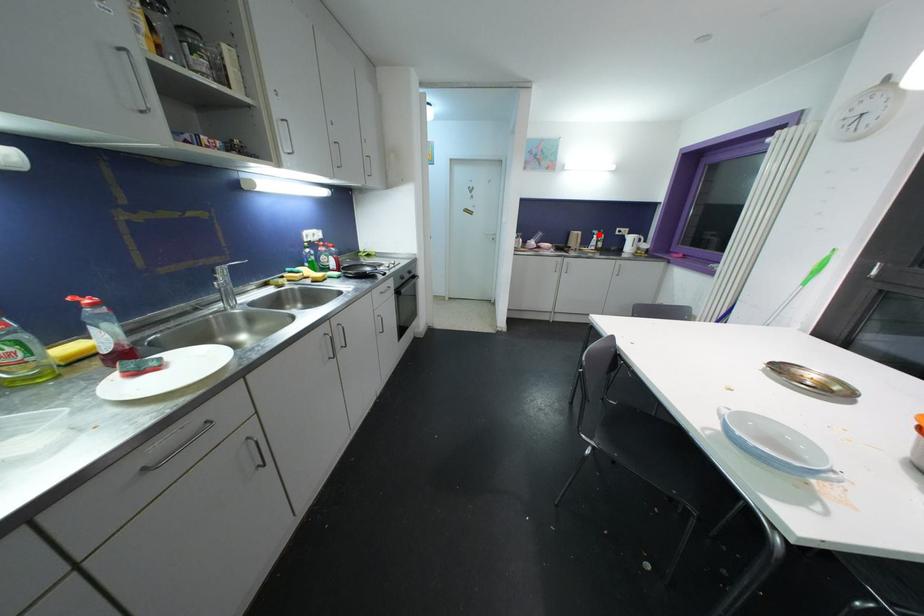
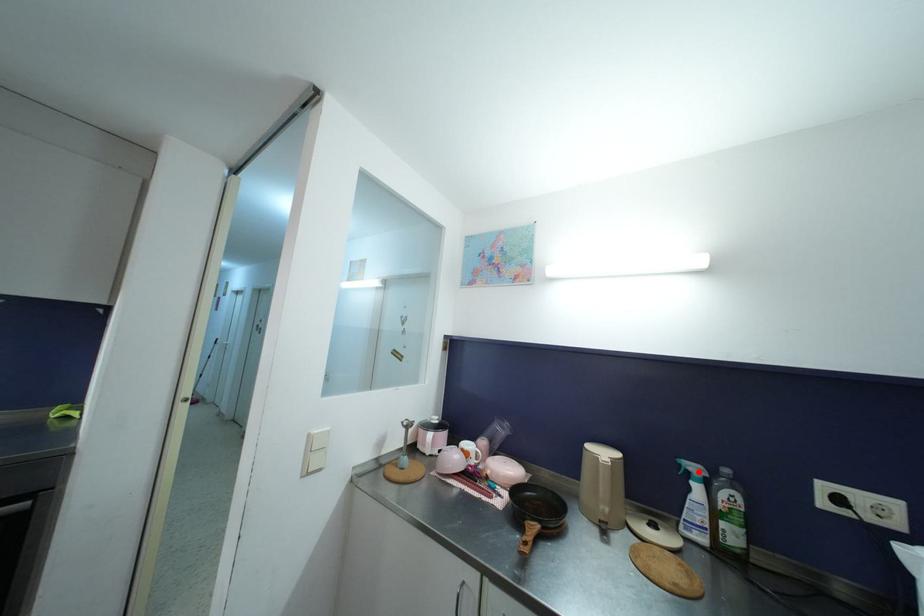
I am providing you with two images of the same scene from different viewpoints. A red point is marked on the first image and another point is marked on the second image. Is the marked point in image1 the same physical position as the marked point in image2?

Yes